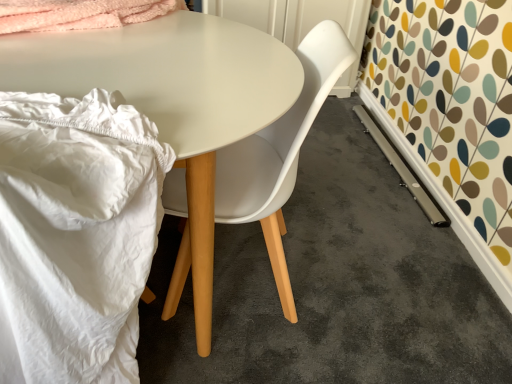
Question: Is white glossy table at center placed right next to white fabric at left?

Choices:
 (A) yes
 (B) no

Answer: (B)

Question: Is white glossy table at center far away from white fabric at left?

Choices:
 (A) yes
 (B) no

Answer: (B)

Question: Would you say white fabric at left is part of white glossy table at center's contents?

Choices:
 (A) yes
 (B) no

Answer: (A)

Question: Is white glossy table at center turned away from white fabric at left?

Choices:
 (A) yes
 (B) no

Answer: (A)

Question: From the image's perspective, does white glossy table at center appear lower than white fabric at left?

Choices:
 (A) yes
 (B) no

Answer: (B)

Question: From the image's perspective, is white glossy table at center located above or below white plastic chair at center?

Choices:
 (A) above
 (B) below

Answer: (B)

Question: Is white glossy table at center inside or outside of white plastic chair at center?

Choices:
 (A) outside
 (B) inside

Answer: (A)

Question: Considering the positions of white glossy table at center and white plastic chair at center in the image, is white glossy table at center taller or shorter than white plastic chair at center?

Choices:
 (A) tall
 (B) short

Answer: (B)

Question: Looking at the image, does white glossy table at center seem bigger or smaller compared to white plastic chair at center?

Choices:
 (A) small
 (B) big

Answer: (B)

Question: Is white fabric at left wider or thinner than white glossy table at center?

Choices:
 (A) thin
 (B) wide

Answer: (A)

Question: Relative to white glossy table at center, is white fabric at left in front or behind?

Choices:
 (A) behind
 (B) front

Answer: (B)

Question: From a real-world perspective, is white fabric at left above or below white glossy table at center?

Choices:
 (A) above
 (B) below

Answer: (A)

Question: Would you say white fabric at left is to the left or to the right of white glossy table at center in the picture?

Choices:
 (A) right
 (B) left

Answer: (B)

Question: Which is correct: white fabric at left is inside white plastic chair at center, or outside of it?

Choices:
 (A) outside
 (B) inside

Answer: (A)

Question: Is point click(x=148, y=187) positioned closer to the camera than point click(x=169, y=286)?

Choices:
 (A) farther
 (B) closer

Answer: (B)